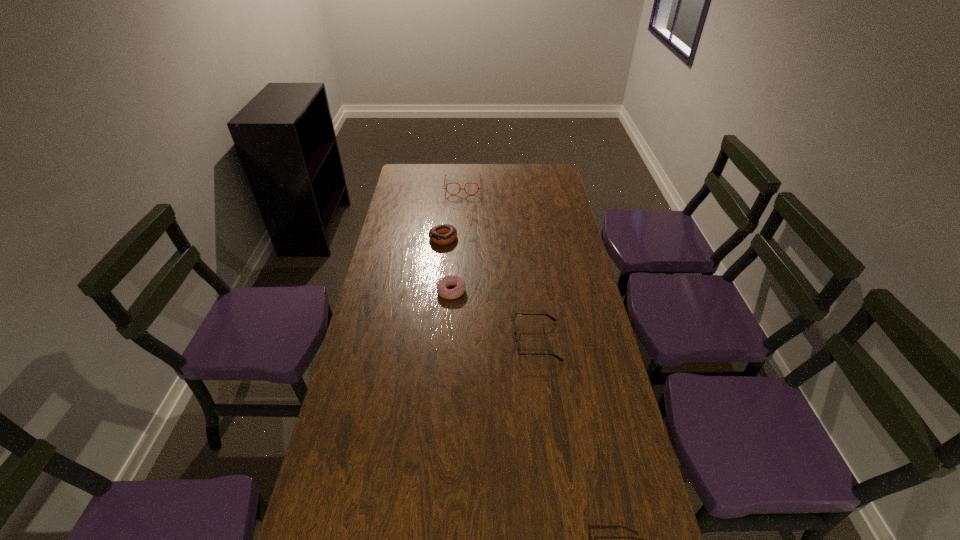
You are a GUI agent. You are given a task and a screenshot of the screen. Output one action in this format:
    pyautogui.click(x=<x>, y=<y>)
    Task: Click on the free spot between the second farthest object and the farther spectacles
    
    Given the screenshot: What is the action you would take?
    pyautogui.click(x=453, y=212)

Find the location of `free point between the shorter doughnut and the farther spectacles`. free point between the shorter doughnut and the farther spectacles is located at coordinates (457, 239).

The image size is (960, 540). In order to click on free spot between the nearer doughnut and the farther doughnut in this screenshot , I will do `click(447, 265)`.

Image resolution: width=960 pixels, height=540 pixels. In order to click on vacant area between the nearer doughnut and the farthest object in this screenshot , I will do `click(457, 239)`.

Choose which object is the nearest neighbor to the farther doughnut. Please provide its 2D coordinates. Your answer should be formatted as a tuple, i.e. [(x, y)], where the tuple contains the x and y coordinates of a point satisfying the conditions above.

[(446, 281)]

What are the coordinates of `the fourth closest object to the sunglasses` in the screenshot? It's located at click(x=445, y=175).

Where is `free space that satisfies the following two spatial constraints: 1. on the front side of the second farthest object; 2. on the left side of the shorter doughnut`? This screenshot has height=540, width=960. free space that satisfies the following two spatial constraints: 1. on the front side of the second farthest object; 2. on the left side of the shorter doughnut is located at coordinates (438, 292).